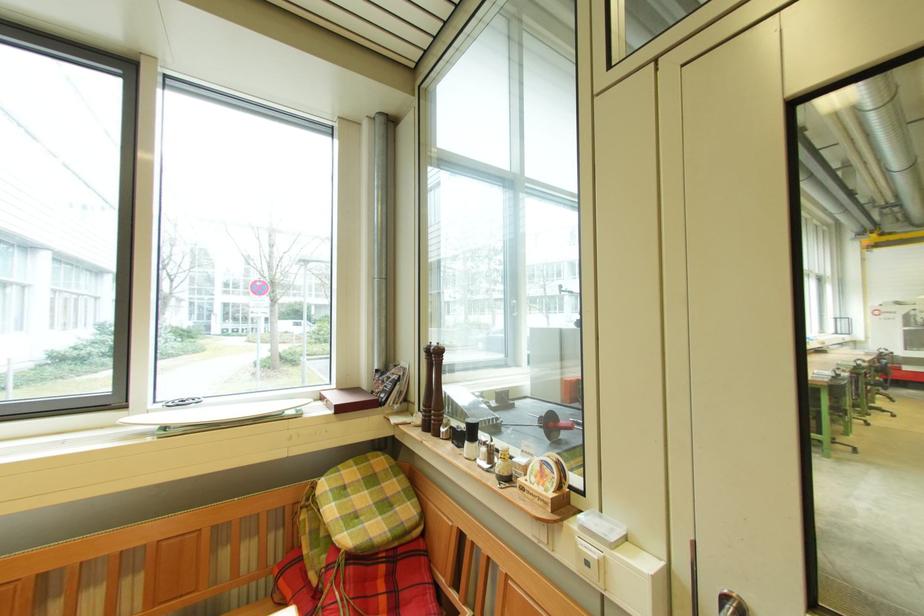
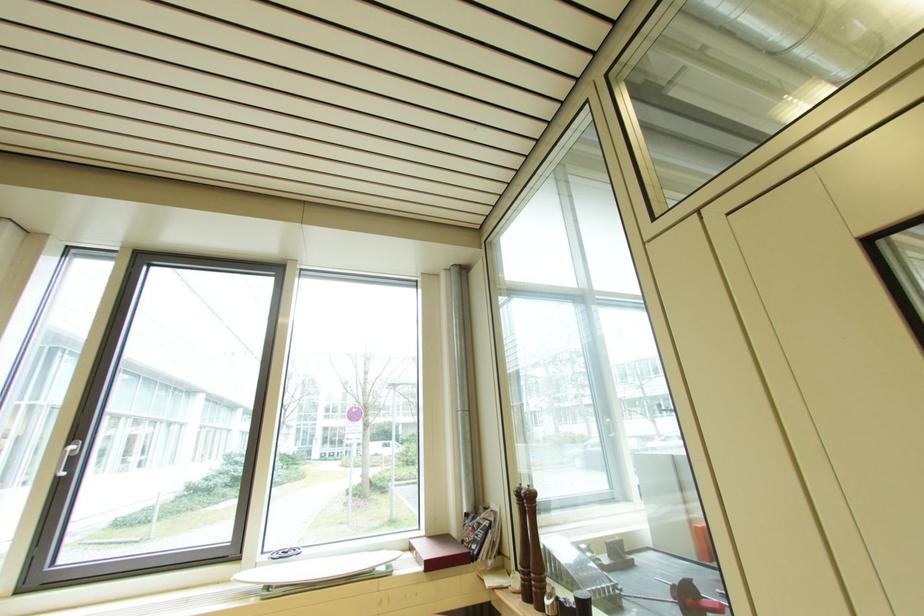
Question: I am providing you with two images of the same scene from different viewpoints. Which of the following objects are not visible in image2?

Choices:
 (A) dark wood grinder
 (B) red and black dumbbell
 (C) white oval tray
 (D) none of these

Answer: (D)